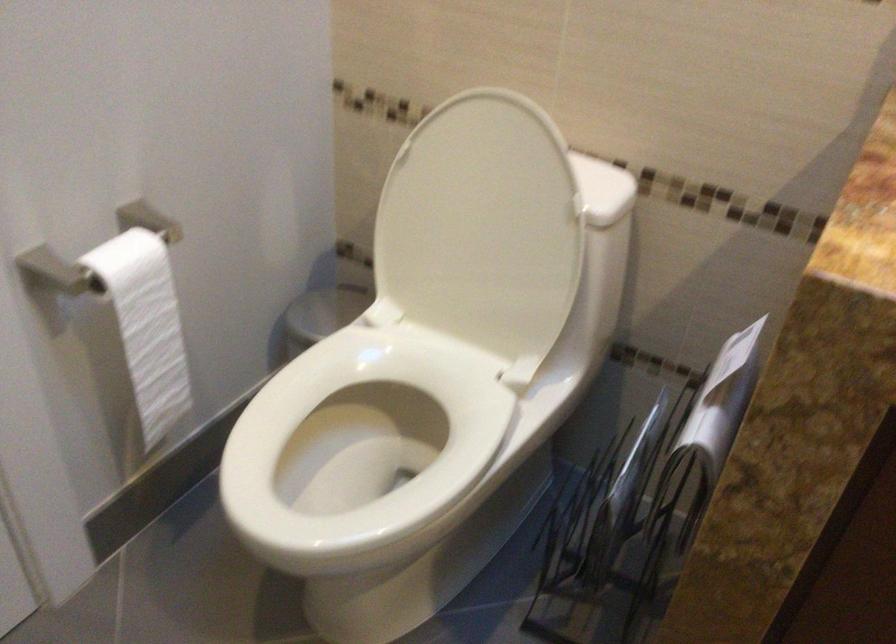
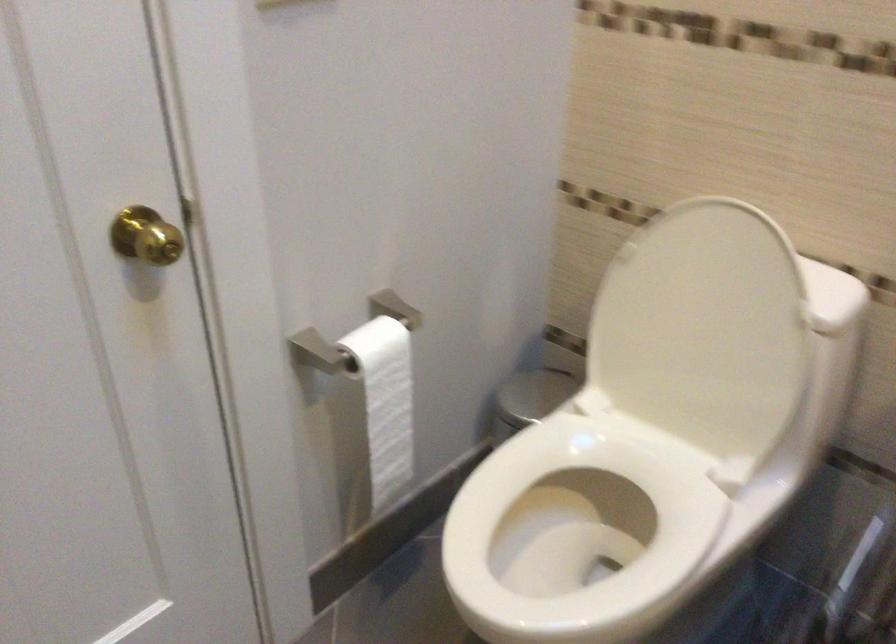
Question: The camera is either moving clockwise (left) or counter-clockwise (right) around the object. The first image is from the beginning of the video and the second image is from the end. Is the camera moving left or right when shooting the video?

Choices:
 (A) Left
 (B) Right

Answer: (B)